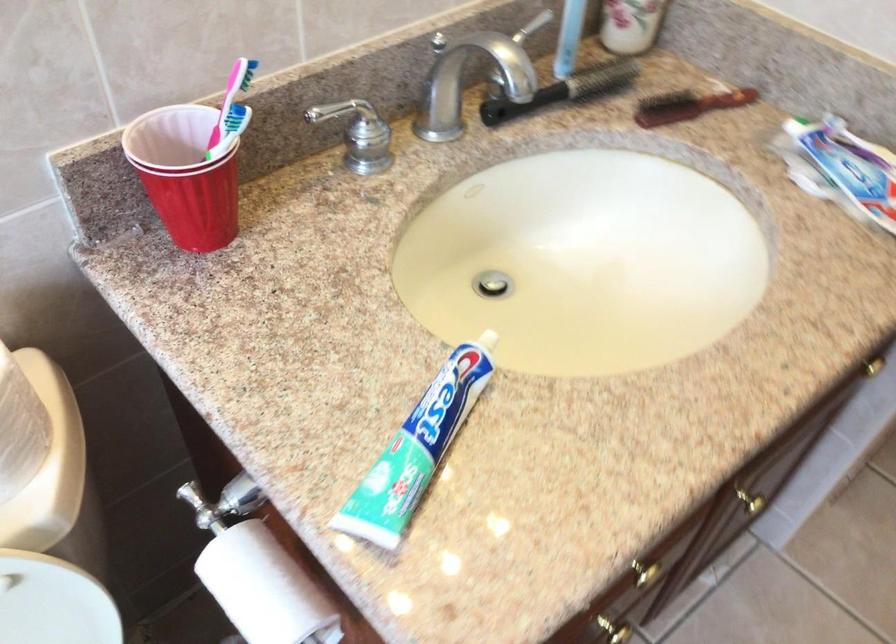
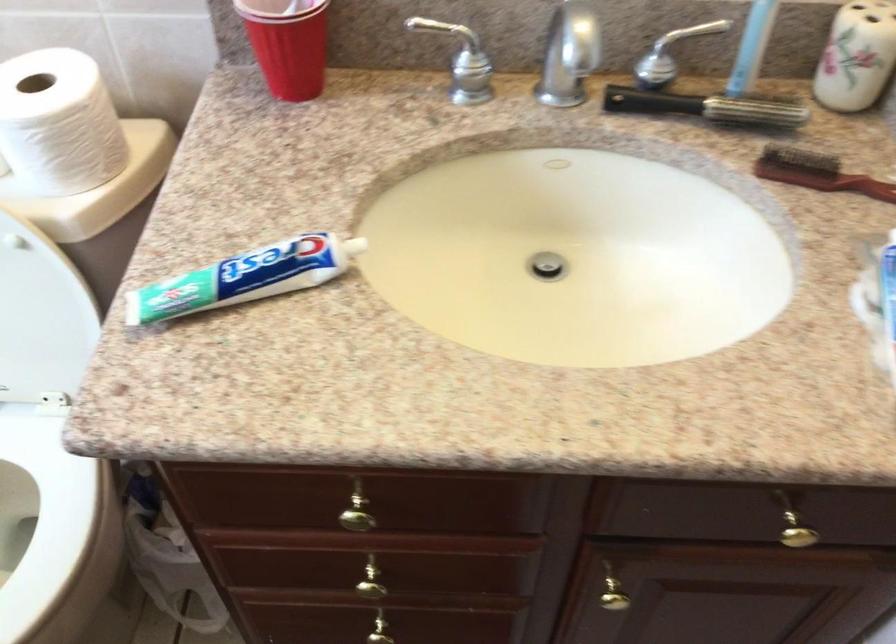
The point at [438,431] is marked in the first image. Where is the corresponding point in the second image?

(245, 277)